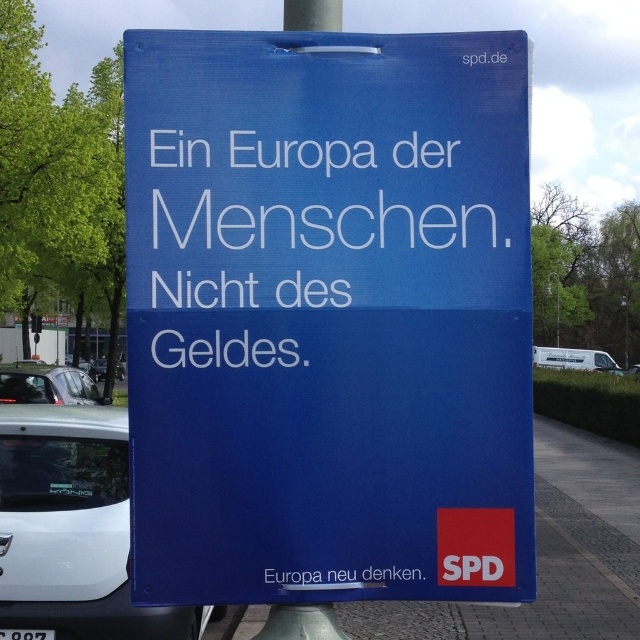
Question: Is blue paper sign at center bigger than white glossy car at lower left?

Choices:
 (A) yes
 (B) no

Answer: (B)

Question: Is white glossy car at lower left positioned at the back of white paper text at center?

Choices:
 (A) yes
 (B) no

Answer: (A)

Question: Which of these objects is positioned closest to the white glossy car at lower left?

Choices:
 (A) blue paper sign at center
 (B) white paper text at center

Answer: (A)

Question: Is white text on blue sign at center smaller than metallic silver car at lower left?

Choices:
 (A) yes
 (B) no

Answer: (A)

Question: Which point is farther to the camera?

Choices:
 (A) white glossy car at lower left
 (B) white paper text at center

Answer: (A)

Question: Which of the following is the farthest from the observer?

Choices:
 (A) white text on blue sign at center
 (B) metallic silver car at lower left

Answer: (B)